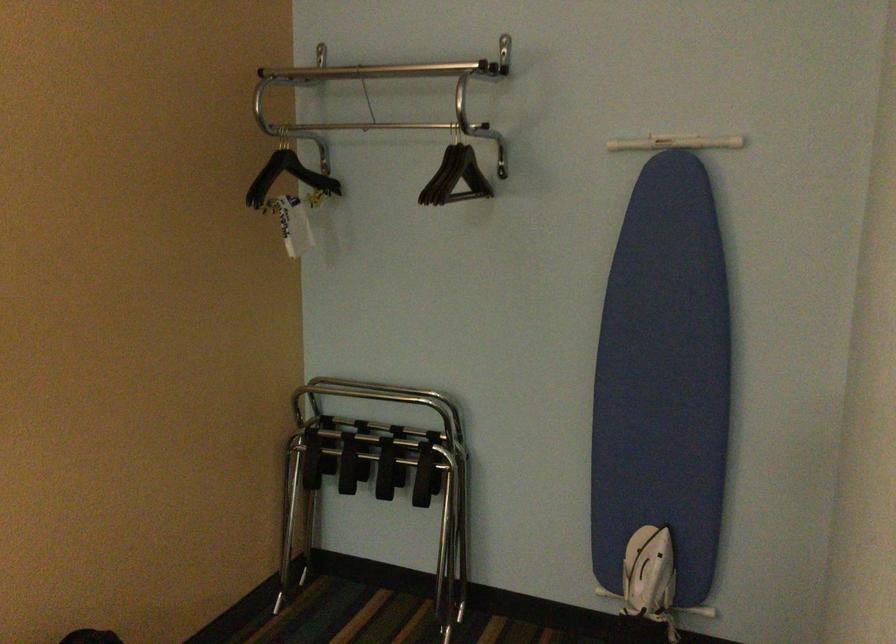
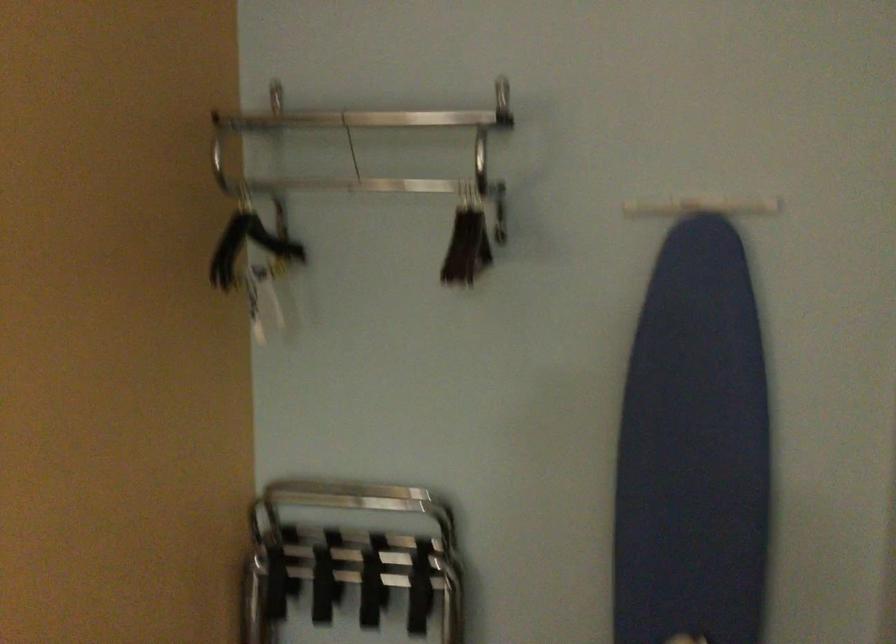
In the second image, find the point that corresponds to (x=375, y=453) in the first image.

(350, 562)